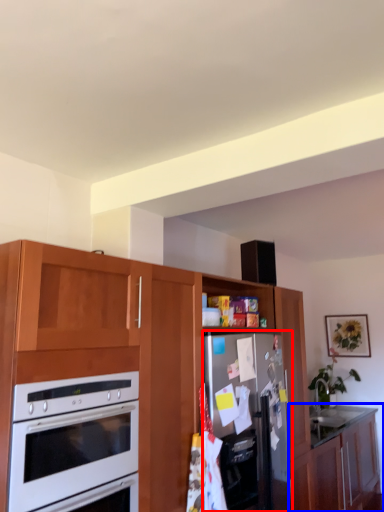
Question: Which object appears farthest to the camera in this image, refrigerator (highlighted by a red box) or cabinetry (highlighted by a blue box)?

Choices:
 (A) refrigerator
 (B) cabinetry

Answer: (B)